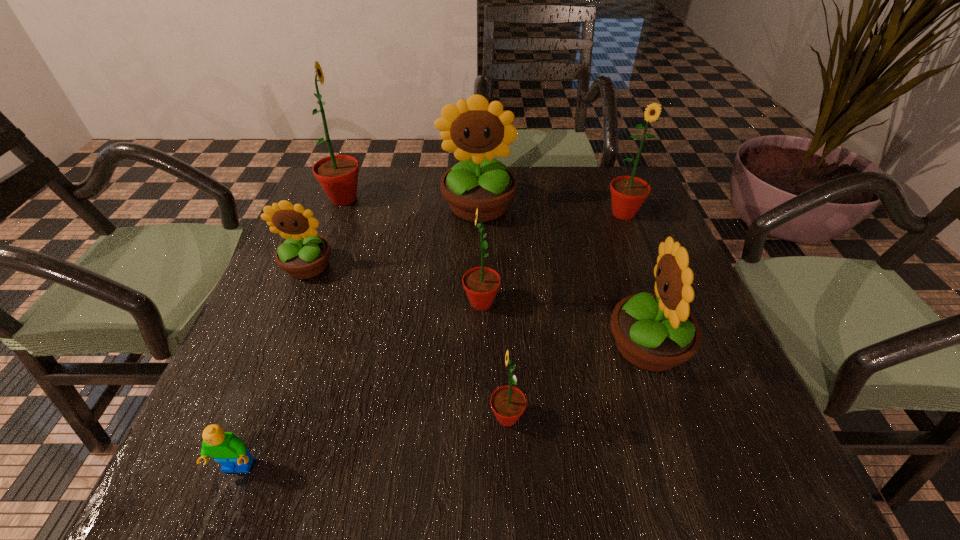
This screenshot has width=960, height=540. Find the location of `the nearest green sunflower`. the nearest green sunflower is located at coordinates (508, 403).

The height and width of the screenshot is (540, 960). Find the location of `the seventh farthest object`. the seventh farthest object is located at coordinates (508, 403).

Image resolution: width=960 pixels, height=540 pixels. I want to click on green Lego, so click(x=226, y=448).

In order to click on Lego in this screenshot , I will do `click(226, 448)`.

This screenshot has height=540, width=960. Find the location of `vacant area situated on the face of the tallest sunflower`. vacant area situated on the face of the tallest sunflower is located at coordinates (457, 199).

This screenshot has height=540, width=960. Identify the location of vacant space located 0.360m on the face of the farthest yellow sunflower. pyautogui.click(x=477, y=345).

What are the coordinates of `vacant space located on the face of the third smallest green sunflower` in the screenshot? It's located at (647, 274).

Find the location of a particular element. Image resolution: width=960 pixels, height=540 pixels. vacant space situated 0.060m on the face of the rightmost yellow sunflower is located at coordinates (575, 346).

Locate an element on the screen. free point located 0.400m on the face of the rightmost yellow sunflower is located at coordinates (397, 346).

You are a GUI agent. You are given a task and a screenshot of the screen. Output one action in this format:
    pyautogui.click(x=<x>, y=<y>)
    Task: Click on the free location located 0.220m on the face of the rightmost yellow sunflower
    This screenshot has height=540, width=960.
    Given the screenshot: What is the action you would take?
    pyautogui.click(x=492, y=346)